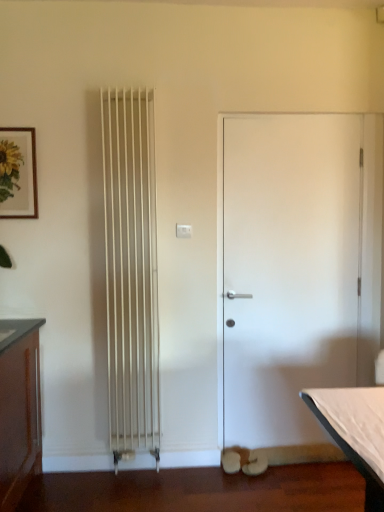
Question: Is white matte door at center not inside wooden framed sunflower print at upper left?

Choices:
 (A) yes
 (B) no

Answer: (A)

Question: From a real-world perspective, is white matte door at center physically above wooden framed sunflower print at upper left?

Choices:
 (A) yes
 (B) no

Answer: (B)

Question: Does white matte door at center turn towards wooden framed sunflower print at upper left?

Choices:
 (A) no
 (B) yes

Answer: (A)

Question: Does white matte door at center contain wooden framed sunflower print at upper left?

Choices:
 (A) no
 (B) yes

Answer: (A)

Question: Considering the relative sizes of white matte door at center and wooden framed sunflower print at upper left in the image provided, is white matte door at center wider than wooden framed sunflower print at upper left?

Choices:
 (A) no
 (B) yes

Answer: (B)

Question: Is white matte door at center to the right of wooden framed sunflower print at upper left from the viewer's perspective?

Choices:
 (A) yes
 (B) no

Answer: (A)

Question: From a real-world perspective, is wooden framed sunflower print at upper left physically below white matte door at center?

Choices:
 (A) no
 (B) yes

Answer: (A)

Question: From the image's perspective, is wooden framed sunflower print at upper left on top of white matte door at center?

Choices:
 (A) no
 (B) yes

Answer: (B)

Question: Is wooden framed sunflower print at upper left thinner than white matte door at center?

Choices:
 (A) no
 (B) yes

Answer: (B)

Question: Does wooden framed sunflower print at upper left touch white matte door at center?

Choices:
 (A) yes
 (B) no

Answer: (B)

Question: Can you confirm if wooden framed sunflower print at upper left is taller than white matte door at center?

Choices:
 (A) no
 (B) yes

Answer: (A)

Question: From the image's perspective, is wooden framed sunflower print at upper left located beneath white matte door at center?

Choices:
 (A) yes
 (B) no

Answer: (B)

Question: Does point (9, 138) appear closer or farther from the camera than point (263, 382)?

Choices:
 (A) closer
 (B) farther

Answer: (A)